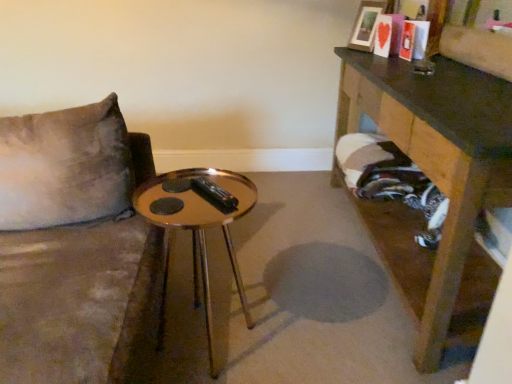
Question: Is wooden table at right, which is the 1th table from right to left, taller or shorter than wooden picture frame at upper right?

Choices:
 (A) tall
 (B) short

Answer: (A)

Question: Looking at the image, does wooden table at right, the 2th table from the left, seem bigger or smaller compared to wooden picture frame at upper right?

Choices:
 (A) small
 (B) big

Answer: (B)

Question: Which is farther from the wooden table at right, which is the 1th table from right to left?

Choices:
 (A) wooden picture frame at upper right
 (B) gold reflective table at center, which appears as the 2th table when viewed from the right

Answer: (B)

Question: Based on their relative distances, which object is nearer to the wooden table at right, the 2th table from the left?

Choices:
 (A) wooden picture frame at upper right
 (B) gold reflective table at center, placed as the first table when sorted from left to right

Answer: (A)